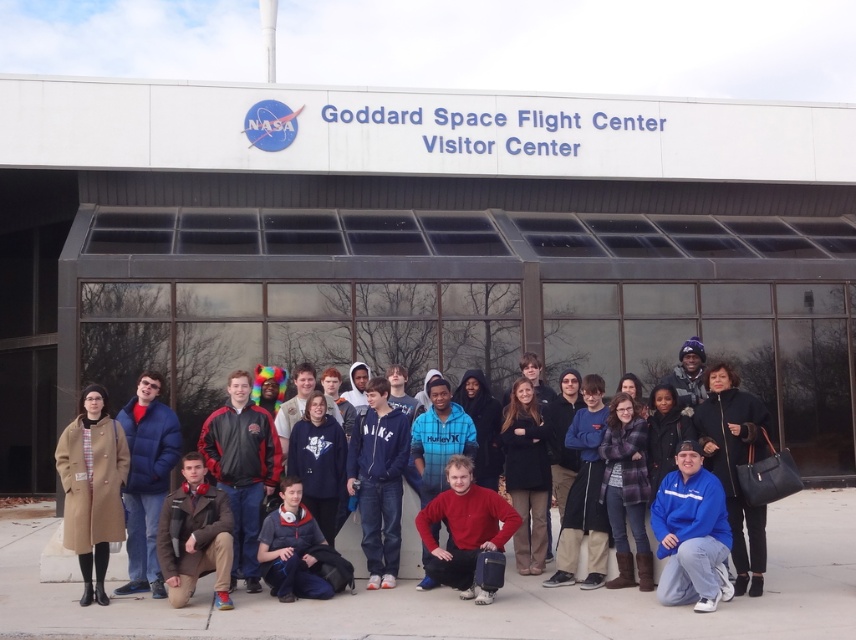
Is blue puffy jacket at center above red matte sweater at lower center?

Correct, blue puffy jacket at center is located above red matte sweater at lower center.

From the picture: Who is more forward, (134, 461) or (489, 509)?

Point (489, 509) is more forward.

Identify the location of blue puffy jacket at center. (146, 480).

Who is positioned more to the left, dark brown leather jacket at center or brown leather jacket at lower left?

brown leather jacket at lower left

Describe the element at coordinates (539, 435) in the screenshot. The height and width of the screenshot is (640, 856). I see `dark brown leather jacket at center` at that location.

I want to click on dark brown leather jacket at center, so click(539, 435).

In the scene shown: Is blue fleece jacket at lower right smaller than red matte sweater at lower center?

Indeed, blue fleece jacket at lower right has a smaller size compared to red matte sweater at lower center.

Who is higher up, blue fleece jacket at lower right or red matte sweater at lower center?

Positioned higher is blue fleece jacket at lower right.

The image size is (856, 640). Identify the location of blue fleece jacket at lower right. (691, 532).